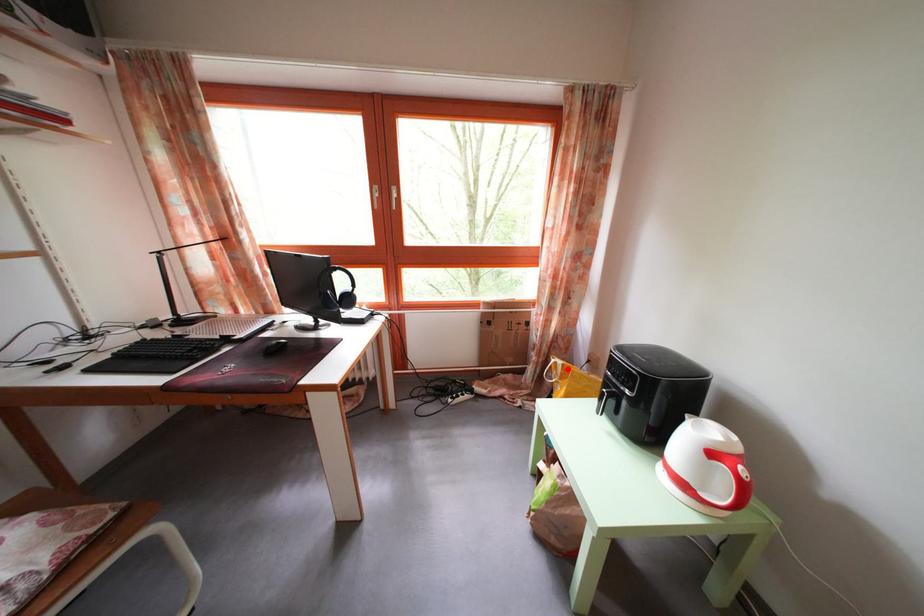
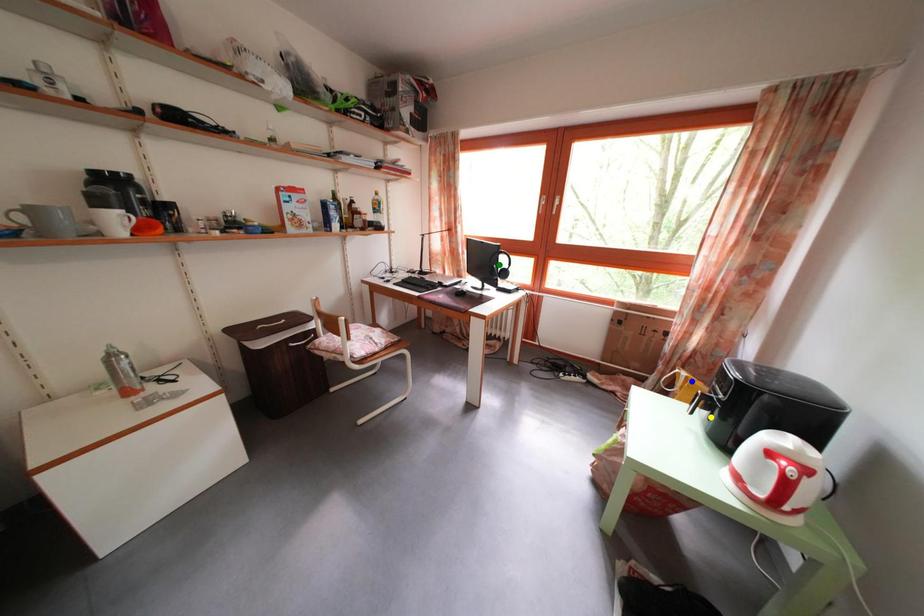
Question: I am providing you with two images of the same scene from different viewpoints. A red point is marked on the first image. You are given multiple points on the second image. Which spot in image 2 lines up with the point in image 1?

Choices:
 (A) yellow point
 (B) blue point
 (C) green point

Answer: (B)